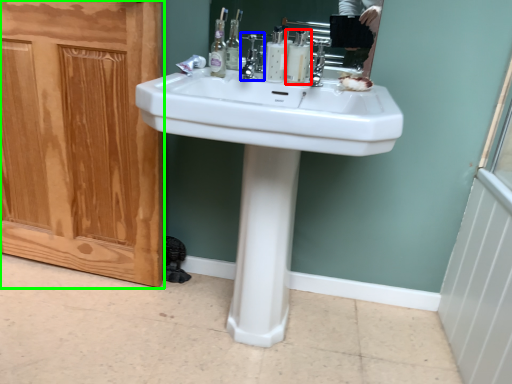
Question: Which is nearer to the mouthwash (highlighted by a red box)? faucet (highlighted by a blue box) or screen door (highlighted by a green box).

Choices:
 (A) faucet
 (B) screen door

Answer: (A)